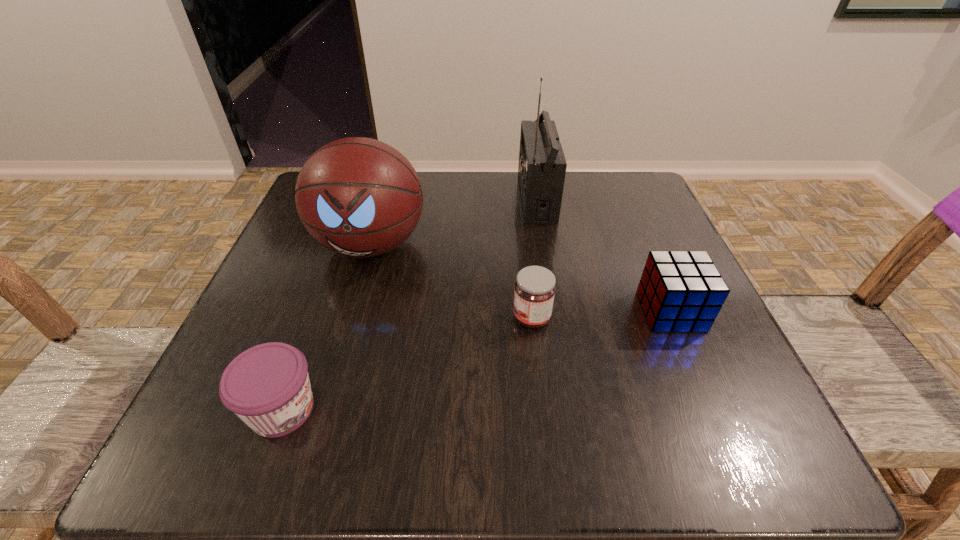
The width and height of the screenshot is (960, 540). Identify the location of radio receiver. (542, 166).

Where is `the second tallest object`? This screenshot has width=960, height=540. the second tallest object is located at coordinates (359, 197).

Locate an element on the screen. the rightmost object is located at coordinates (680, 291).

The height and width of the screenshot is (540, 960). Identify the location of the right jam. (534, 293).

Locate an element on the screen. The image size is (960, 540). the nearest object is located at coordinates (267, 386).

The image size is (960, 540). Find the location of `the nearer jam`. the nearer jam is located at coordinates (267, 386).

Find the location of `vacant space situated on the front panel of the radio receiver`. vacant space situated on the front panel of the radio receiver is located at coordinates 345,198.

Identify the location of vacant space located on the front panel of the radio receiver. The width and height of the screenshot is (960, 540). (396, 198).

Image resolution: width=960 pixels, height=540 pixels. What are the coordinates of `vacant area situated on the front panel of the radio receiver` in the screenshot? It's located at coord(401,198).

This screenshot has width=960, height=540. Find the location of `vacant area located 0.370m on the right of the basketball`. vacant area located 0.370m on the right of the basketball is located at coordinates (612, 245).